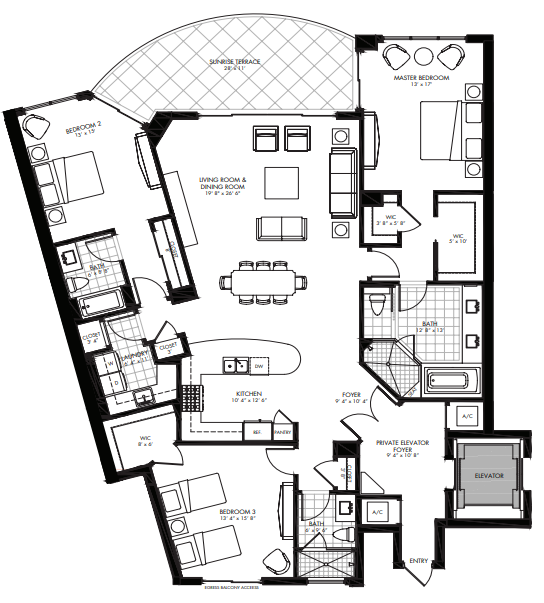
You are a GUI agent. You are given a task and a screenshot of the screen. Output one action in this format:
    pyautogui.click(x=<x>, y=<y>)
    Task: Click on the "elevator" written in black capital letters
    The width and height of the screenshot is (544, 603).
    Given the screenshot: What is the action you would take?
    pyautogui.click(x=482, y=474)